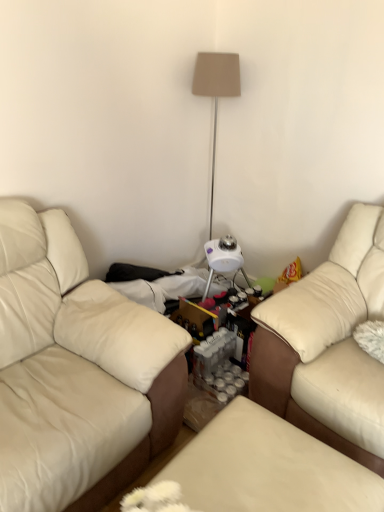
Question: Is beige fabric lampshade at upper center bigger or smaller than beige leather couch at left, the 2th studio couch from the right?

Choices:
 (A) big
 (B) small

Answer: (B)

Question: Do you think beige fabric lampshade at upper center is within beige leather couch at left, the 2th studio couch from the right, or outside of it?

Choices:
 (A) inside
 (B) outside

Answer: (B)

Question: Estimate the real-world distances between objects in this image. Which object is closer to the leather couch at right, which is the 1th studio couch in right-to-left order?

Choices:
 (A) leather ottoman at center
 (B) beige leather couch at left, the first studio couch when ordered from left to right
 (C) beige fabric lampshade at upper center

Answer: (A)

Question: Estimate the real-world distances between objects in this image. Which object is farther from the beige fabric lampshade at upper center?

Choices:
 (A) beige leather couch at left, the first studio couch when ordered from left to right
 (B) leather couch at right, positioned as the 2th studio couch in left-to-right order
 (C) leather ottoman at center

Answer: (C)